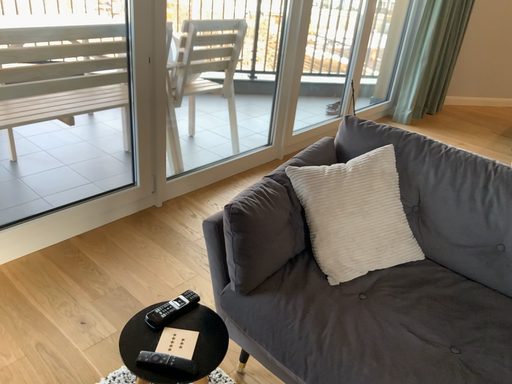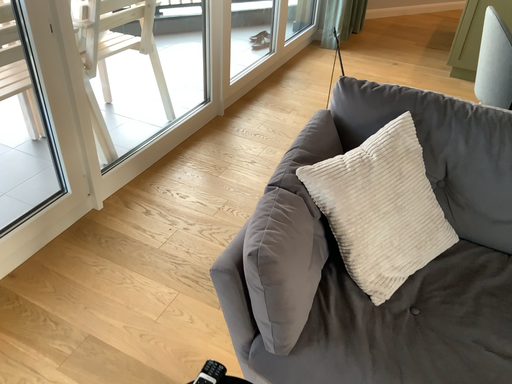
Question: Which way did the camera rotate in the video?

Choices:
 (A) rotated right
 (B) rotated left

Answer: (A)